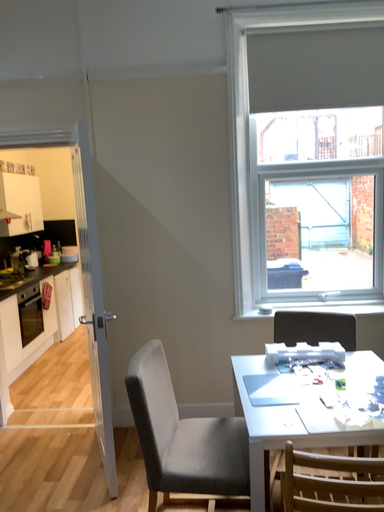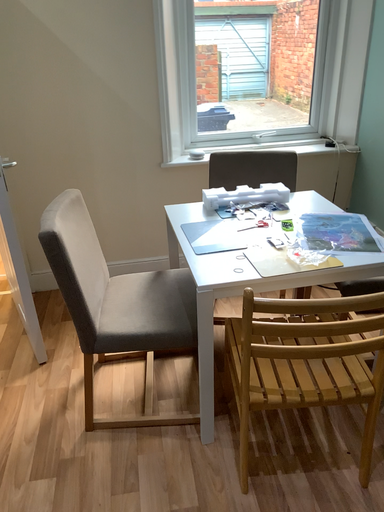
Question: Which way did the camera rotate in the video?

Choices:
 (A) rotated left
 (B) rotated right

Answer: (B)